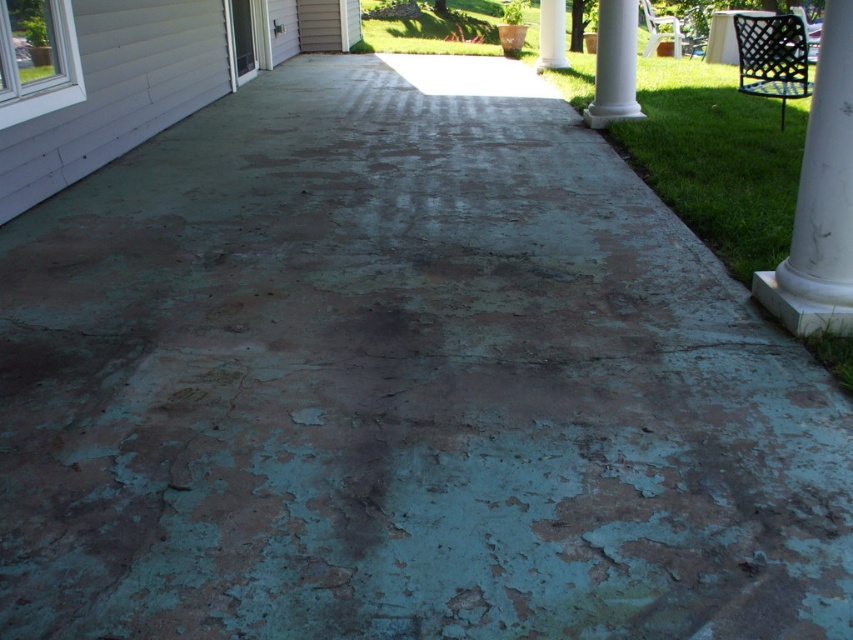
Based on the photo, you are a contractor assessing the porch for repairs. You notice the white marble pillar at right and the white smooth column at center. Which one requires more material if you need to cover their entire surfaces with a protective coating?

The white marble pillar at right requires more material because it has a larger size compared to the white smooth column at center.

You are planning to place a large potted plant between the white marble pillar at right and the white smooth column at upper center. Considering their sizes, which object should the plant be placed closer to?

The white marble pillar at right is bigger than the white smooth column at upper center, so the plant should be placed closer to the white marble pillar at right to maintain balance.